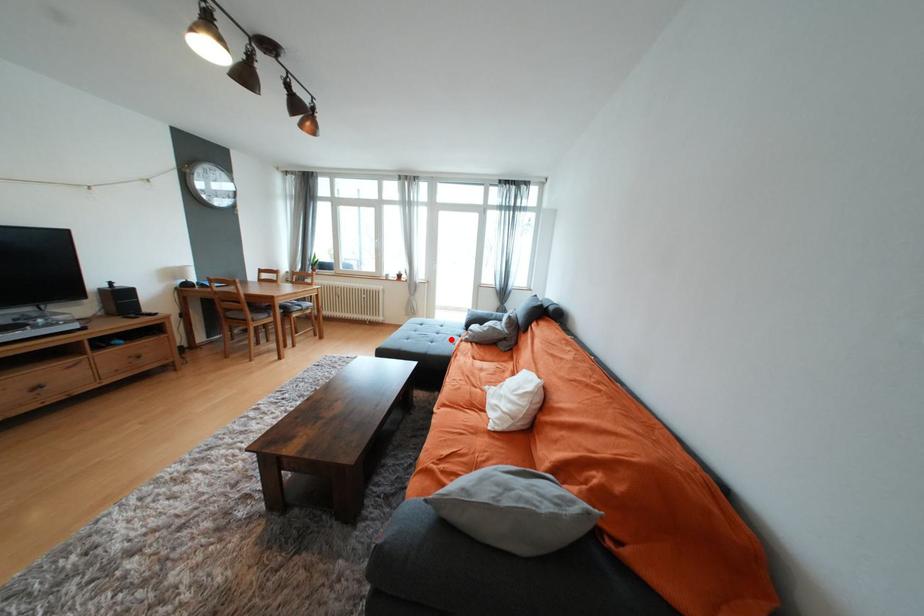
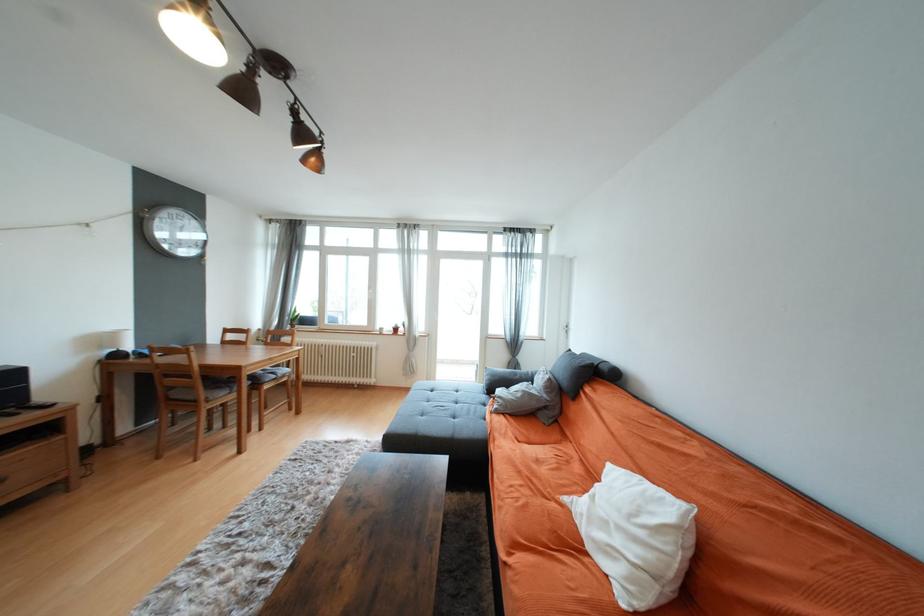
Question: I am providing you with two images of the same scene from different viewpoints. Given a red point in image1, look at the same physical point in image2. Is it:

Choices:
 (A) Closer to the viewpoint
 (B) Farther from the viewpoint

Answer: (A)